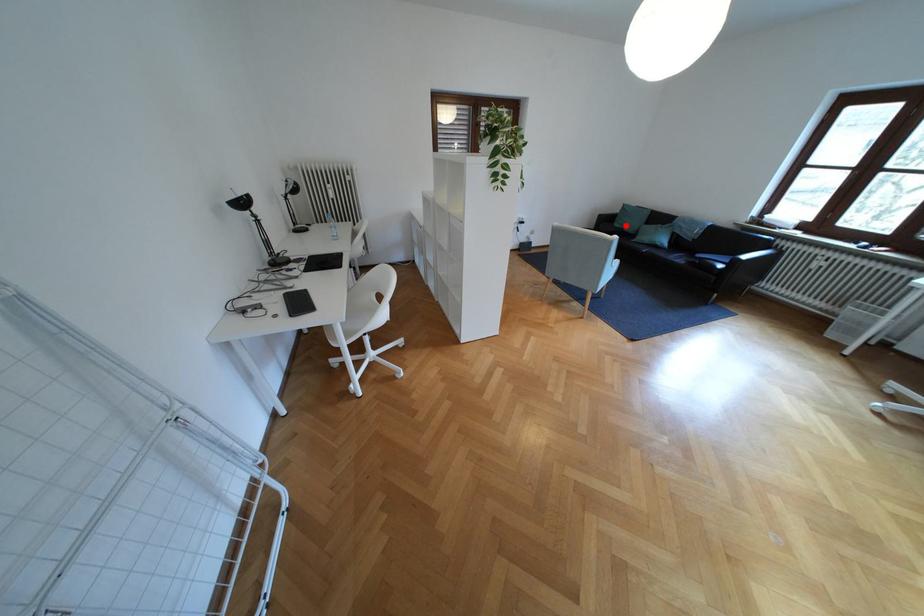
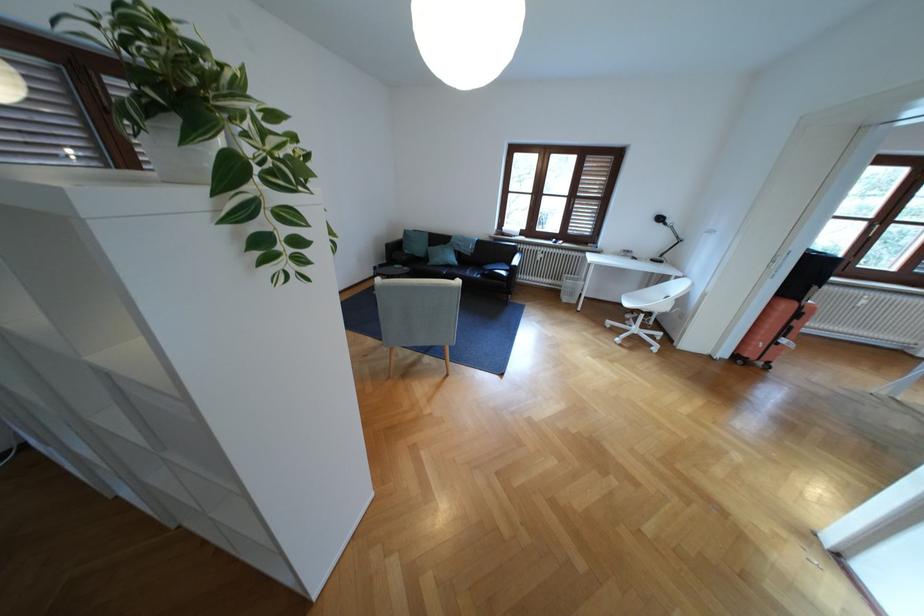
Question: I am providing you with two images of the same scene from different viewpoints. Image1 has a red point marked. In image2, the corresponding 3D location appears at what relative position? Reply with the corresponding letter.

Choices:
 (A) Closer
 (B) Farther

Answer: (A)